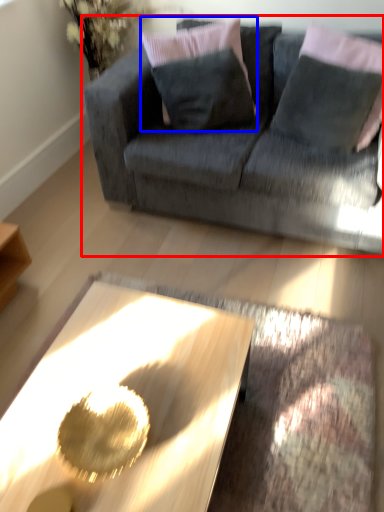
Question: Among these objects, which one is nearest to the camera, studio couch (highlighted by a red box) or pillow (highlighted by a blue box)?

Choices:
 (A) studio couch
 (B) pillow

Answer: (A)